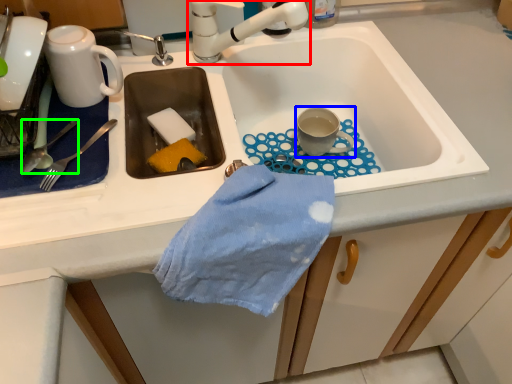
Question: Considering the real-world distances, which object is closest to tap (highlighted by a red box)? coffee cup (highlighted by a blue box) or silverware (highlighted by a green box).

Choices:
 (A) coffee cup
 (B) silverware

Answer: (A)